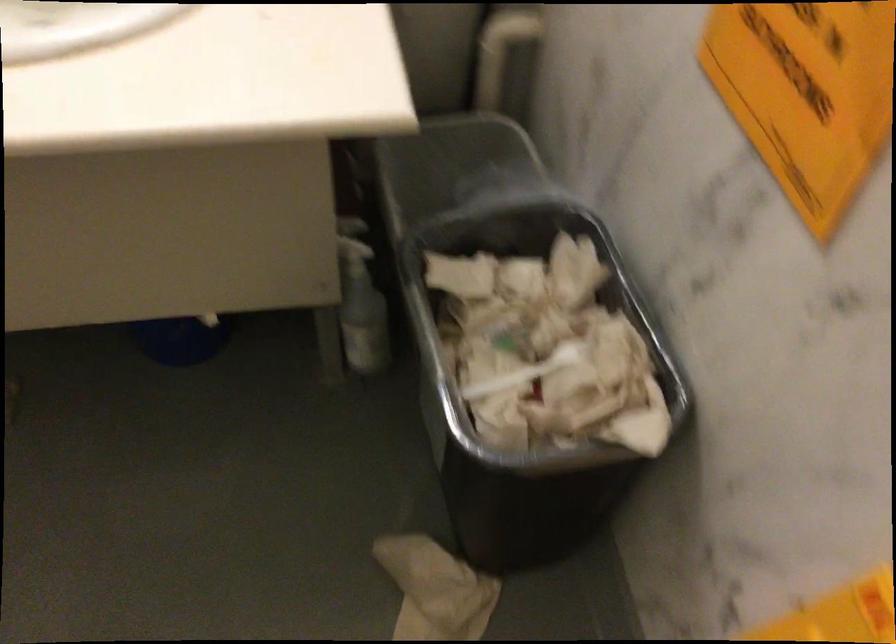
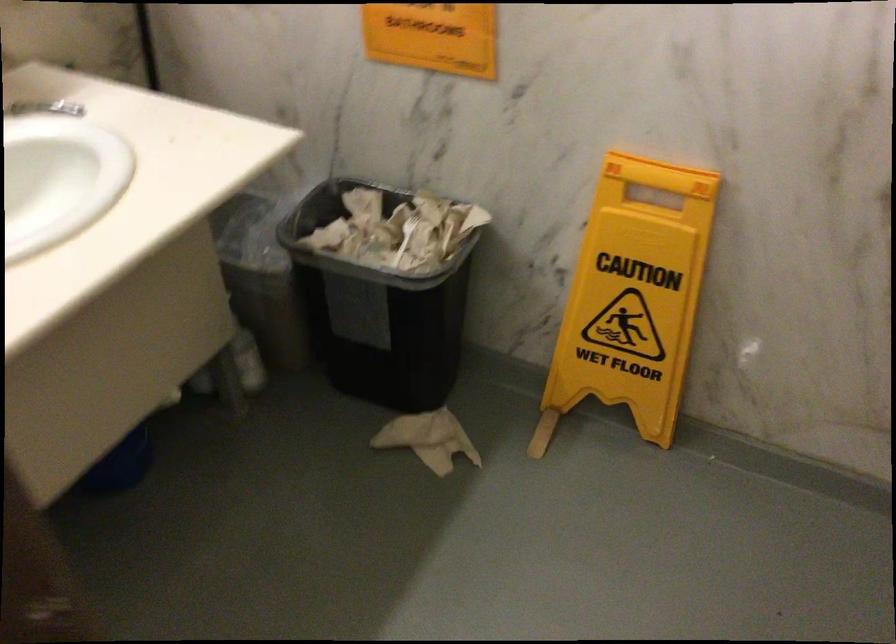
Question: How did the camera likely rotate?

Choices:
 (A) Left
 (B) Right
 (C) Up
 (D) Down

Answer: (B)